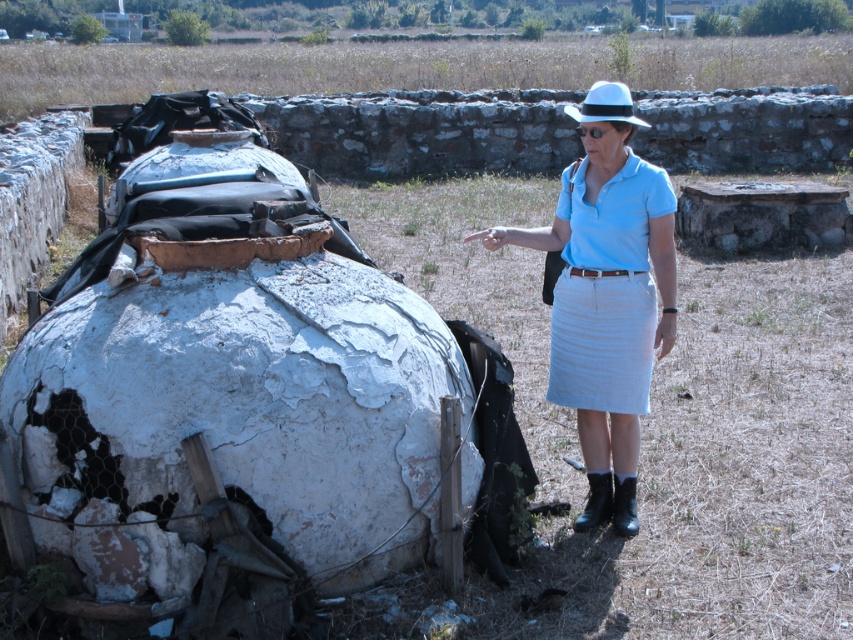
Between light blue cotton skirt at right and white felt hat at upper center, which one appears on the right side from the viewer's perspective?

Positioned to the right is white felt hat at upper center.

Does light blue cotton skirt at right have a larger size compared to white felt hat at upper center?

Incorrect, light blue cotton skirt at right is not larger than white felt hat at upper center.

Who is more forward, [563,208] or [646,122]?

Point [563,208] is in front.

I want to click on light blue cotton skirt at right, so click(x=606, y=289).

Based on the photo, is light blue cotton shirt at center thinner than light blue cotton skirt at right?

No.

Can you confirm if light blue cotton shirt at center is shorter than light blue cotton skirt at right?

No, light blue cotton shirt at center is not shorter than light blue cotton skirt at right.

Is point (630, 230) farther from camera compared to point (572, 241)?

No, it is not.

This screenshot has width=853, height=640. In order to click on light blue cotton shirt at center in this screenshot , I will do `click(606, 307)`.

Between point (619, 177) and point (607, 113), which one is positioned behind?

Point (619, 177)

Which is in front, point (660, 280) or point (598, 113)?

Point (598, 113) is in front.

Where is `light blue cotton shirt at center`? light blue cotton shirt at center is located at coordinates (606, 307).